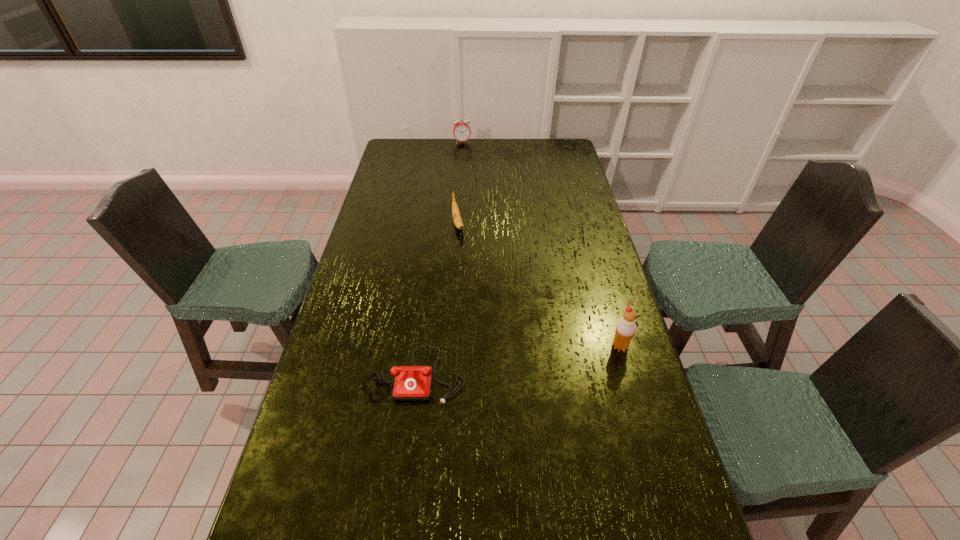
I want to click on the shortest object, so click(x=412, y=383).

This screenshot has height=540, width=960. I want to click on the tallest object, so click(625, 329).

You are a GUI agent. You are given a task and a screenshot of the screen. Output one action in this format:
    pyautogui.click(x=<x>, y=<y>)
    Task: Click on the rightmost object
    Image resolution: width=960 pixels, height=540 pixels.
    Given the screenshot: What is the action you would take?
    pyautogui.click(x=625, y=329)

Identify the location of banana. This screenshot has height=540, width=960. (456, 215).

Locate an element on the screen. The height and width of the screenshot is (540, 960). the second farthest object is located at coordinates (456, 215).

The height and width of the screenshot is (540, 960). In order to click on the third shortest object in this screenshot , I will do `click(461, 130)`.

Locate an element on the screen. This screenshot has height=540, width=960. the farthest object is located at coordinates (461, 130).

Where is `free space located on the dial of the telephone`? The height and width of the screenshot is (540, 960). free space located on the dial of the telephone is located at coordinates (400, 482).

At what (x,y) coordinates should I click in order to perform the action: click on blank space located on the peel of the banana from the top. Please return your answer as a coordinate pair (x, y). The width and height of the screenshot is (960, 540). Looking at the image, I should click on (467, 265).

What are the coordinates of `vacant region located on the peel of the banana from the top` in the screenshot? It's located at (468, 274).